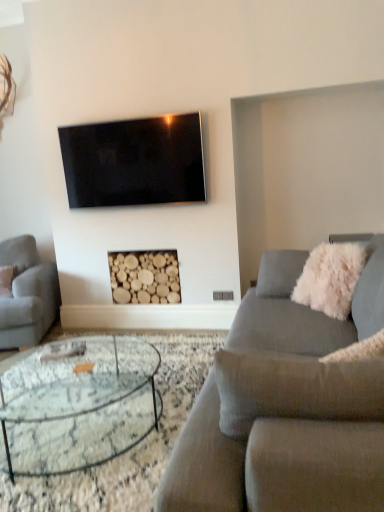
Question: From the image's perspective, is textured gray couch at center, which is counted as the 1th studio couch, starting from the front, positioned above or below white fluffy pillow at right?

Choices:
 (A) below
 (B) above

Answer: (A)

Question: Considering the positions of textured gray couch at center, which is counted as the second studio couch, starting from the back, and white fluffy pillow at right in the image, is textured gray couch at center, which is counted as the second studio couch, starting from the back, wider or thinner than white fluffy pillow at right?

Choices:
 (A) thin
 (B) wide

Answer: (B)

Question: Considering the real-world distances, which object is farthest from the textured gray couch at center, acting as the 2th studio couch starting from the left?

Choices:
 (A) light gray fabric couch at left, the first studio couch when ordered from back to front
 (B) white fluffy pillow at right
 (C) clear glass coffee table at center
 (D) natural wood logs at center
 (E) black glossy tv at upper center

Answer: (A)

Question: Based on their relative distances, which object is farther from the white fluffy pillow at right?

Choices:
 (A) black glossy tv at upper center
 (B) clear glass coffee table at center
 (C) natural wood logs at center
 (D) textured gray couch at center, which is the first studio couch in right-to-left order
 (E) light gray fabric couch at left, arranged as the 2th studio couch when viewed from the front

Answer: (E)